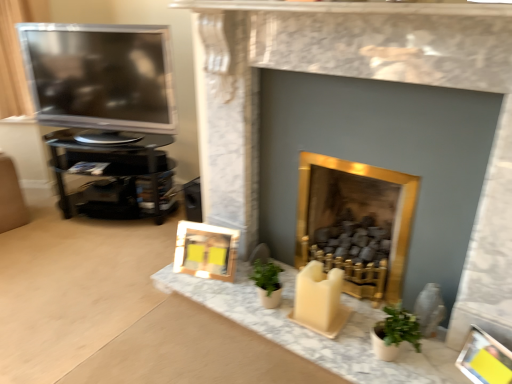
Where is `free space in front of matte gray vase at lower right`? The image size is (512, 384). free space in front of matte gray vase at lower right is located at coordinates (437, 357).